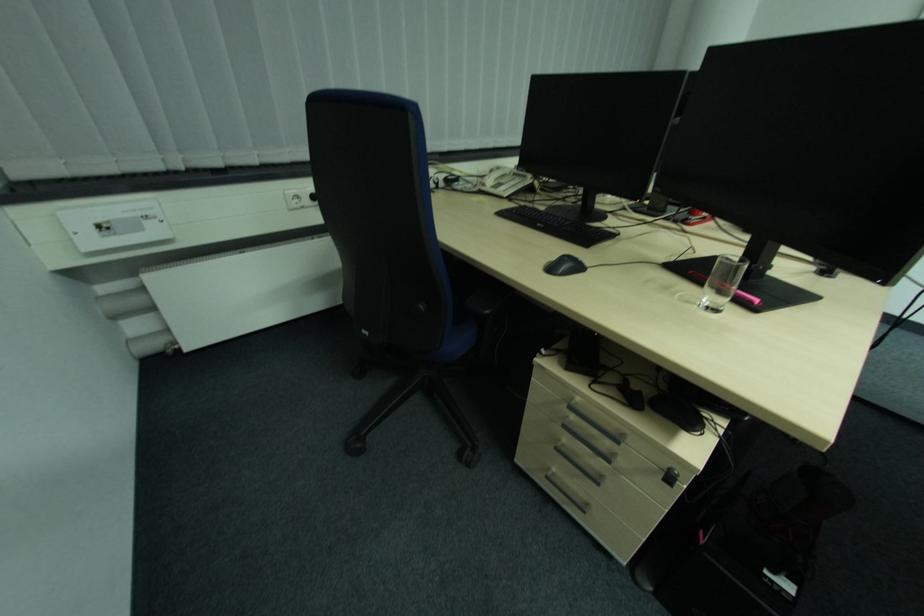
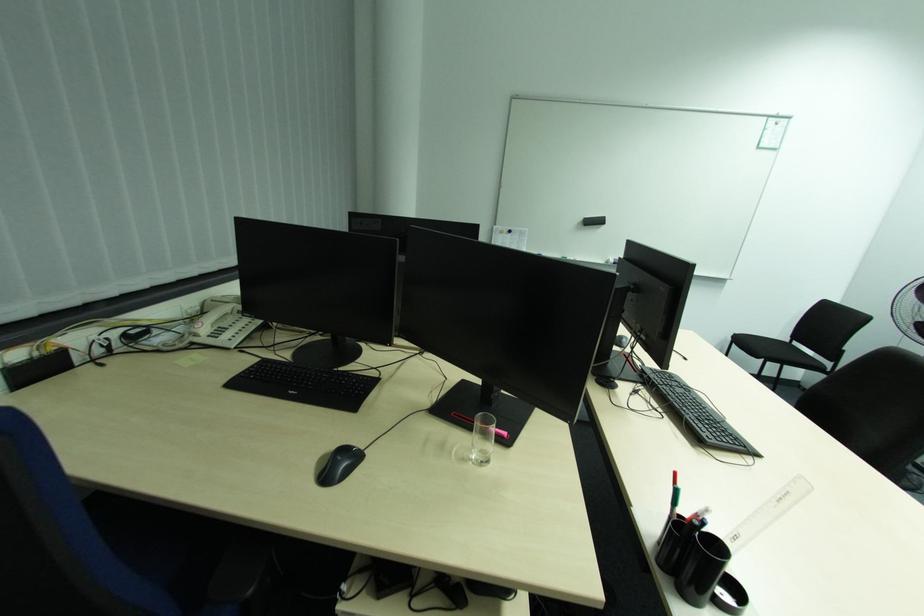
Question: Based on the continuous images, in which direction is the camera rotating? Reply with the corresponding letter.

Choices:
 (A) Left
 (B) Right
 (C) Up
 (D) Down

Answer: (B)